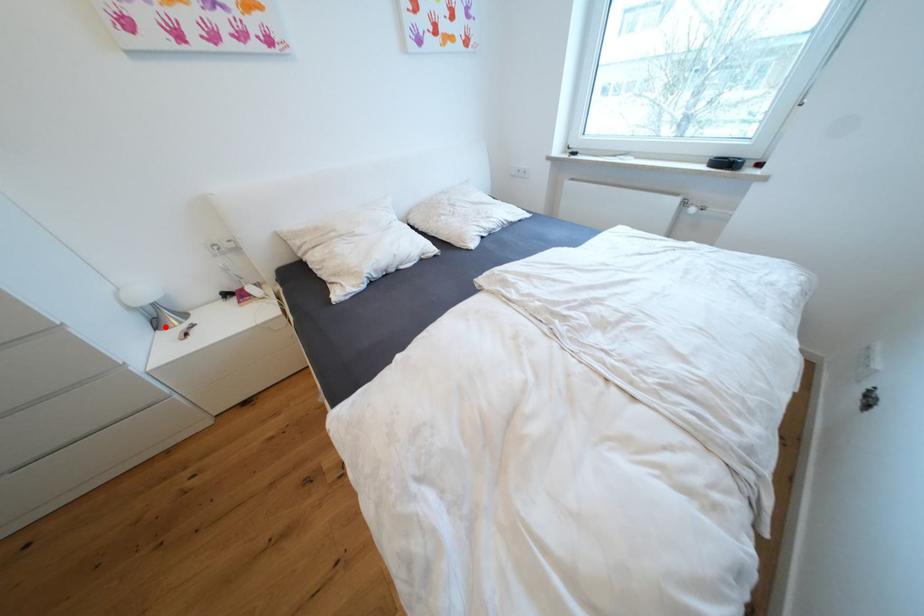
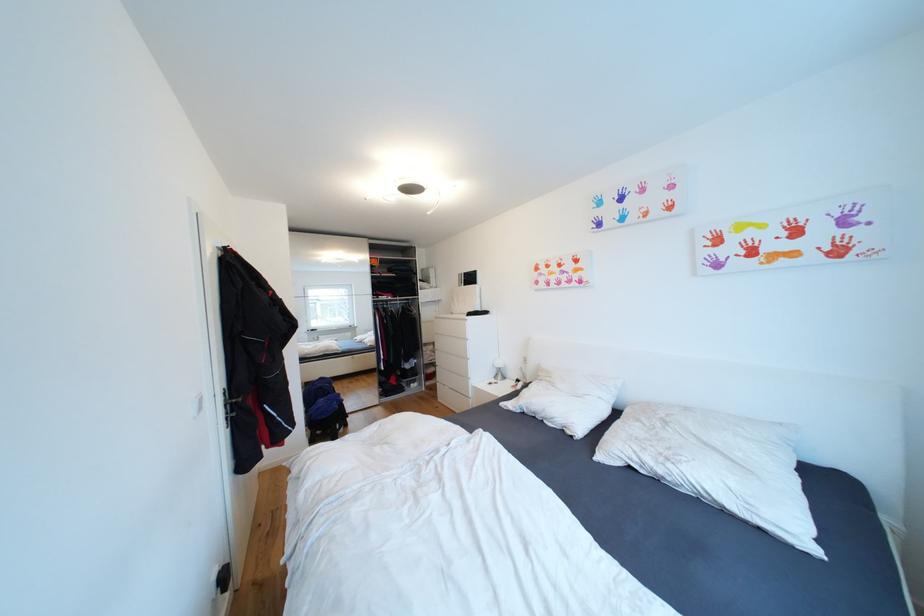
Question: I am providing you with two images of the same scene from different viewpoints. Image1 has a red point marked. In image2, the corresponding 3D location appears at what relative position? Reply with the corresponding letter.

Choices:
 (A) Closer
 (B) Farther

Answer: (B)